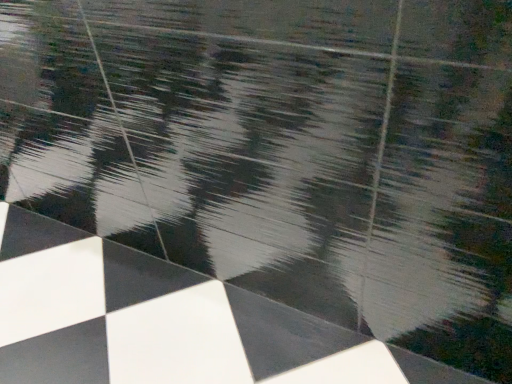
What do you see at coordinates (150, 320) in the screenshot? Image resolution: width=512 pixels, height=384 pixels. I see `white glossy tiles at center` at bounding box center [150, 320].

Where is `white glossy tiles at center`? white glossy tiles at center is located at coordinates (150, 320).

In order to face white glossy tiles at center, should I rotate leftwards or rightwards?

To align with it, rotate left about 15.763°.

Where is `white glossy tiles at center`? white glossy tiles at center is located at coordinates (150, 320).